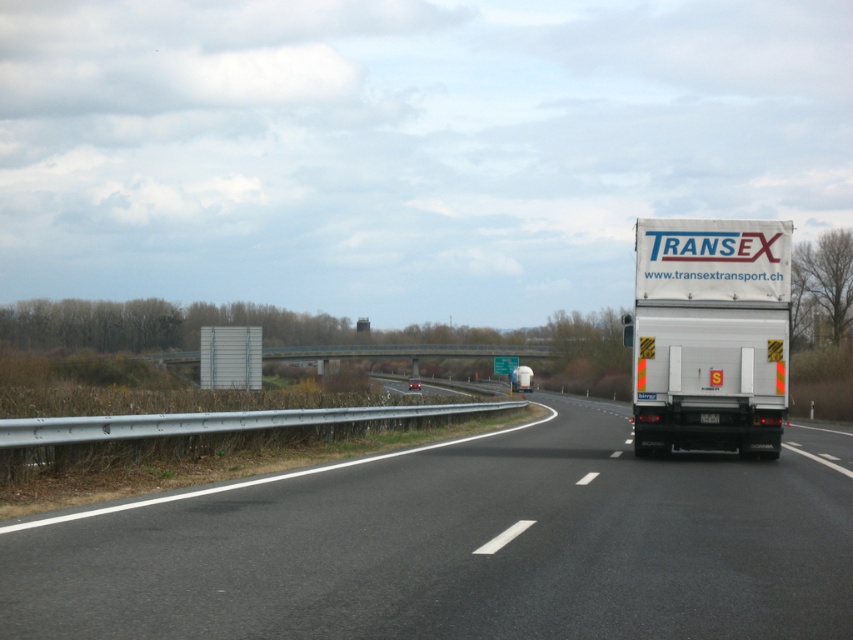
You are driving a car and need to overtake the white matte trailer truck at right on the black asphalt highway at center. The minimum safe distance required to overtake safely is 3.5 meters. Can you safely overtake the truck based on the distance provided?

The black asphalt highway at center is 3.46 meters away from the white matte trailer truck at right. Since 3.46 meters is less than the required 3.5 meters for a safe overtake, you cannot safely overtake the truck at this distance.

You are driving a car and see the black asphalt highway at center and the white matte trailer truck at right. Which object is positioned more to the right side of the scene?

The white matte trailer truck at right is positioned more to the right side of the scene than the black asphalt highway at center.

You are standing at the point marked by the coordinates (462, 545) on the highway. Looking around, you see the metal guardrail on the left side of the road and the grassy area with shrubs beyond it. Which direction should you walk to reach the metal guardrail?

The point marked by the coordinates (462, 545) is on the black asphalt highway at center. Since the metal guardrail is on the left side of the road, you should walk to the left to reach it.